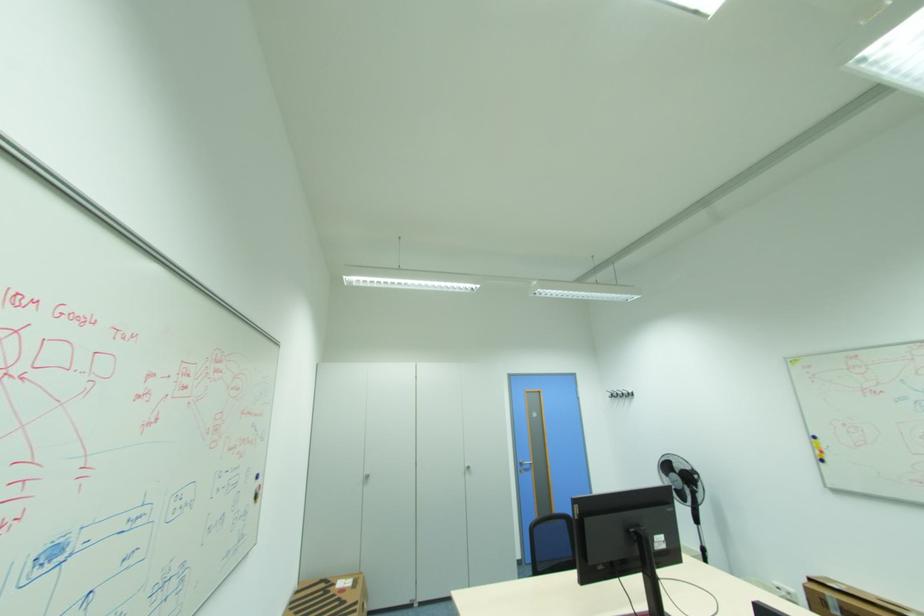
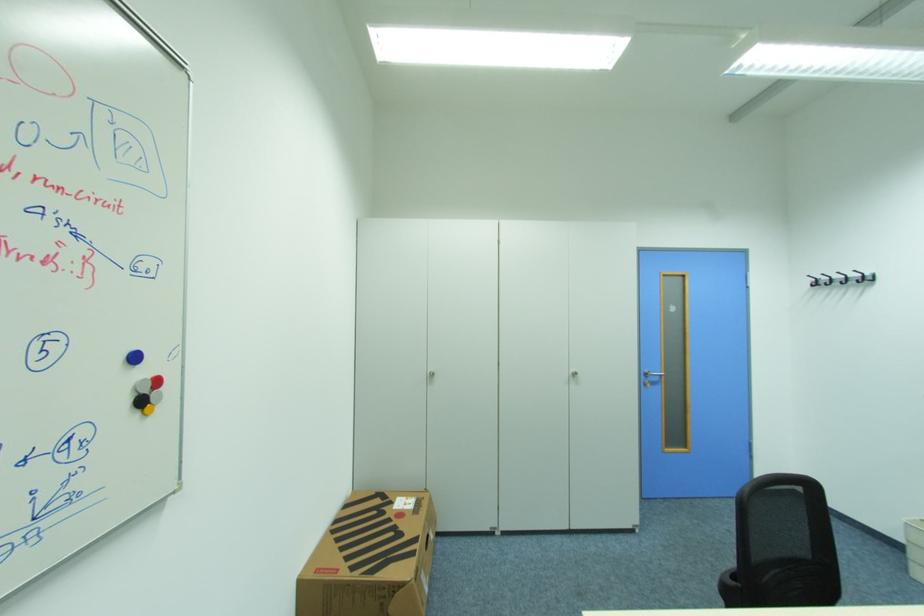
Find the pixel in the second image that matches pixel 527 461 in the first image.

(651, 371)